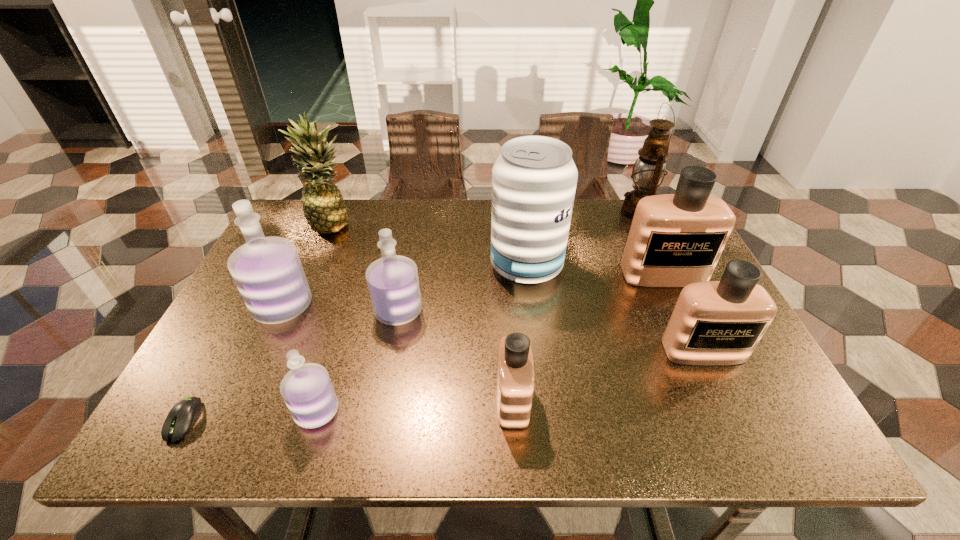
You are a GUI agent. You are given a task and a screenshot of the screen. Output one action in this format:
    pyautogui.click(x=<x>, y=<y>)
    Task: Click on the free space between the fourth farthest perfume and the computer mouse
    The image size is (960, 540).
    Given the screenshot: What is the action you would take?
    pyautogui.click(x=444, y=386)

This screenshot has width=960, height=540. I want to click on free space that is in between the farthest beige perfume and the biggest purple perfume, so click(473, 290).

Locate which object is the seventh closest to the alcohol. Please provide its 2D coordinates. Your answer should be formatted as a tuple, i.e. [(x, y)], where the tuple contains the x and y coordinates of a point satisfying the conditions above.

[(307, 390)]

Find the location of a particular element. The image size is (960, 540). object that stands as the closest to the leftmost perfume is located at coordinates (393, 282).

Identify which perfume is the fourth closest to the alcohol. Please provide its 2D coordinates. Your answer should be formatted as a tuple, i.e. [(x, y)], where the tuple contains the x and y coordinates of a point satisfying the conditions above.

[(515, 369)]

Locate an element on the screen. The height and width of the screenshot is (540, 960). the fourth closest perfume relative to the second biggest beige perfume is located at coordinates tap(307, 390).

The width and height of the screenshot is (960, 540). I want to click on purple perfume that is the closest to the alcohol, so click(393, 282).

Choose which purple perfume is the nearest neighbor to the leftmost beige perfume. Please provide its 2D coordinates. Your answer should be formatted as a tuple, i.e. [(x, y)], where the tuple contains the x and y coordinates of a point satisfying the conditions above.

[(393, 282)]

This screenshot has height=540, width=960. What are the coordinates of `beige perfume identified as the second closest to the leftmost purple perfume` in the screenshot? It's located at (677, 239).

Identify the location of beige perfume that can be found as the second closest to the alcohol. (x=721, y=322).